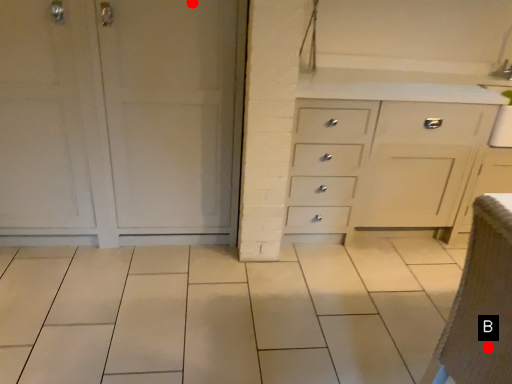
Question: Two points are circled on the image, labeled by A and B beside each circle. Which point is further to the camera?

Choices:
 (A) A is further
 (B) B is further

Answer: (A)